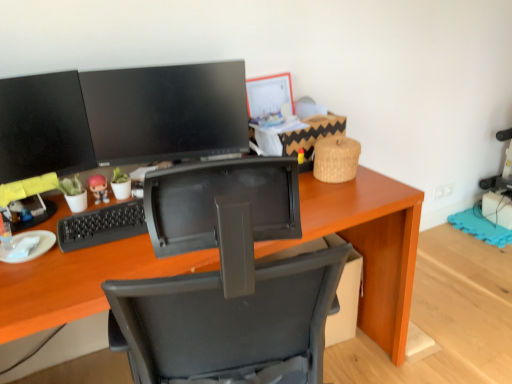
Question: Is matte black monitor at left, which appears as the 1th computer monitor when viewed from the left, smaller than wooden desk at center?

Choices:
 (A) yes
 (B) no

Answer: (A)

Question: Is matte black monitor at left, which appears as the 1th computer monitor when viewed from the left, placed right next to wooden desk at center?

Choices:
 (A) yes
 (B) no

Answer: (B)

Question: Does matte black monitor at left, which is the 2th computer monitor from right to left, have a lesser width compared to wooden desk at center?

Choices:
 (A) yes
 (B) no

Answer: (A)

Question: Can you confirm if matte black monitor at left, which appears as the 1th computer monitor when viewed from the left, is shorter than wooden desk at center?

Choices:
 (A) no
 (B) yes

Answer: (B)

Question: From the image's perspective, is matte black monitor at left, which is the 2th computer monitor from right to left, beneath wooden desk at center?

Choices:
 (A) yes
 (B) no

Answer: (B)

Question: From a real-world perspective, is wooden desk at center physically located above or below matte black monitor at upper center, positioned as the first computer monitor in right-to-left order?

Choices:
 (A) above
 (B) below

Answer: (B)

Question: Considering the positions of wooden desk at center and matte black monitor at upper center, positioned as the first computer monitor in right-to-left order, in the image, is wooden desk at center taller or shorter than matte black monitor at upper center, positioned as the first computer monitor in right-to-left order,?

Choices:
 (A) tall
 (B) short

Answer: (A)

Question: Considering their positions, is wooden desk at center located in front of or behind matte black monitor at upper center, positioned as the first computer monitor in right-to-left order?

Choices:
 (A) front
 (B) behind

Answer: (A)

Question: Is wooden desk at center spatially inside matte black monitor at upper center, positioned as the first computer monitor in right-to-left order, or outside of it?

Choices:
 (A) inside
 (B) outside

Answer: (B)

Question: Is wooden desk at center in front of or behind matte black monitor at left, which is the 2th computer monitor from right to left, in the image?

Choices:
 (A) behind
 (B) front

Answer: (B)

Question: Looking at their shapes, would you say wooden desk at center is wider or thinner than matte black monitor at left, which is the 2th computer monitor from right to left?

Choices:
 (A) thin
 (B) wide

Answer: (B)

Question: Is wooden desk at center situated inside matte black monitor at left, which is the 2th computer monitor from right to left, or outside?

Choices:
 (A) outside
 (B) inside

Answer: (A)

Question: Considering the positions of wooden desk at center and matte black monitor at left, which appears as the 1th computer monitor when viewed from the left, in the image, is wooden desk at center taller or shorter than matte black monitor at left, which appears as the 1th computer monitor when viewed from the left,?

Choices:
 (A) short
 (B) tall

Answer: (B)

Question: Would you say matte black monitor at upper center, marked as the second computer monitor in a left-to-right arrangement, is to the left or to the right of matte plastic figurine at center in the picture?

Choices:
 (A) right
 (B) left

Answer: (A)

Question: Is point (197, 109) closer or farther from the camera than point (93, 195)?

Choices:
 (A) farther
 (B) closer

Answer: (A)